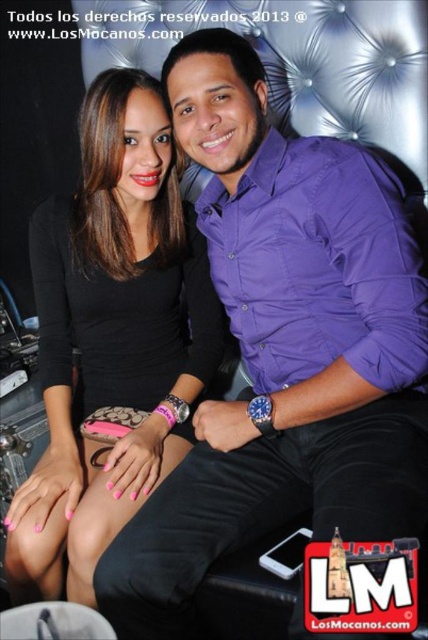
You are a photographer at a fashion event and need to arrange two models wearing the purple satin shirt at center and the black matte dress at center. Based on the scene, which model should stand on the left to maintain the original spatial relationship?

The black matte dress at center should stand on the left because the purple satin shirt at center was originally positioned on its right side.

You are organizing a charity event and need to display two outfits on a mannequin. The purple satin shirt at center and the black matte dress at center must be placed side by side. Based on the image description, which outfit should you choose to occupy the larger space on the mannequin?

The purple satin shirt at center has a larger size compared to the black matte dress at center, so the purple satin shirt at center should occupy the larger space on the mannequin.